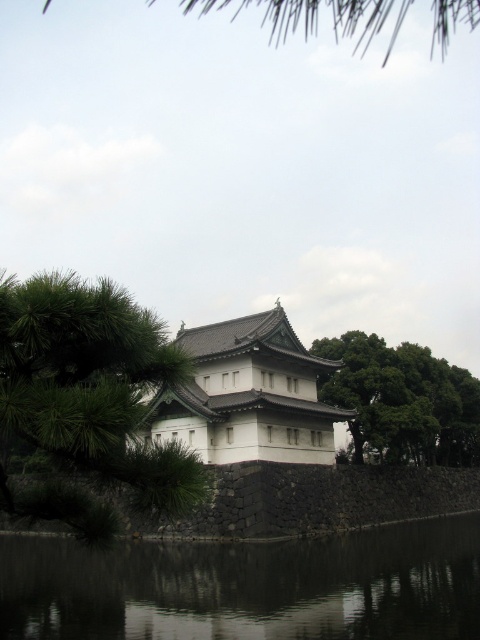
Does green leafy tree at left have a greater width compared to white matte/stone building at center?

Correct, the width of green leafy tree at left exceeds that of white matte/stone building at center.

Does green leafy tree at left appear over white matte/stone building at center?

No.

What are the coordinates of `green leafy tree at left` in the screenshot? It's located at (85, 401).

Between white matte/stone building at center and green leafy tree at center, which one has more height?

green leafy tree at center is taller.

Locate an element on the screen. The image size is (480, 640). white matte/stone building at center is located at coordinates (248, 396).

Does green leafy tree at left lie in front of green leafy tree at center?

Yes, green leafy tree at left is closer to the viewer.

The height and width of the screenshot is (640, 480). Identify the location of green leafy tree at left. (85, 401).